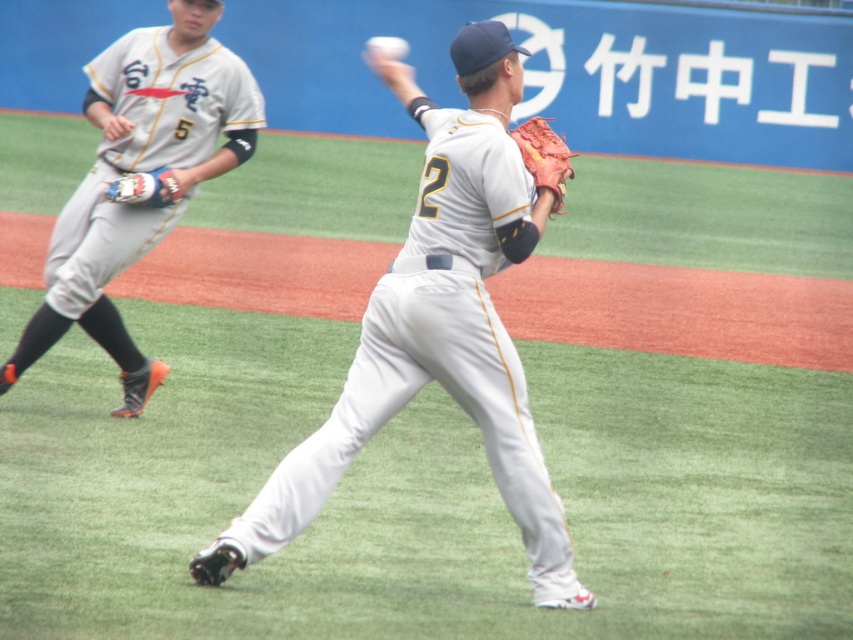
Does white matte baseball glove at upper center have a greater width compared to white matte baseball at center?

Correct, the width of white matte baseball glove at upper center exceeds that of white matte baseball at center.

Who is lower down, white matte baseball glove at upper center or white matte baseball at center?

Positioned lower is white matte baseball glove at upper center.

In order to click on white matte baseball glove at upper center in this screenshot , I will do `click(140, 172)`.

In order to click on white matte baseball glove at upper center in this screenshot , I will do `click(140, 172)`.

Describe the element at coordinates (437, 324) in the screenshot. I see `white matte baseball glove at center` at that location.

Between point (432, 371) and point (532, 140), which one is positioned behind?

Positioned behind is point (532, 140).

What do you see at coordinates (437, 324) in the screenshot? The height and width of the screenshot is (640, 853). I see `white matte baseball glove at center` at bounding box center [437, 324].

You are a GUI agent. You are given a task and a screenshot of the screen. Output one action in this format:
    pyautogui.click(x=<x>, y=<y>)
    Task: Click on the white matte baseball glove at center
    The image size is (853, 640).
    Given the screenshot: What is the action you would take?
    pyautogui.click(x=437, y=324)

Is white matte baseball glove at center closer to the viewer compared to leather glove at left?

Yes.

Is point (456, 51) in front of point (120, 202)?

Yes, point (456, 51) is closer to viewer.

Which is in front, point (496, 145) or point (178, 192)?

Point (496, 145) is more forward.

Where is `white matte baseball glove at center`? white matte baseball glove at center is located at coordinates pyautogui.click(x=437, y=324).